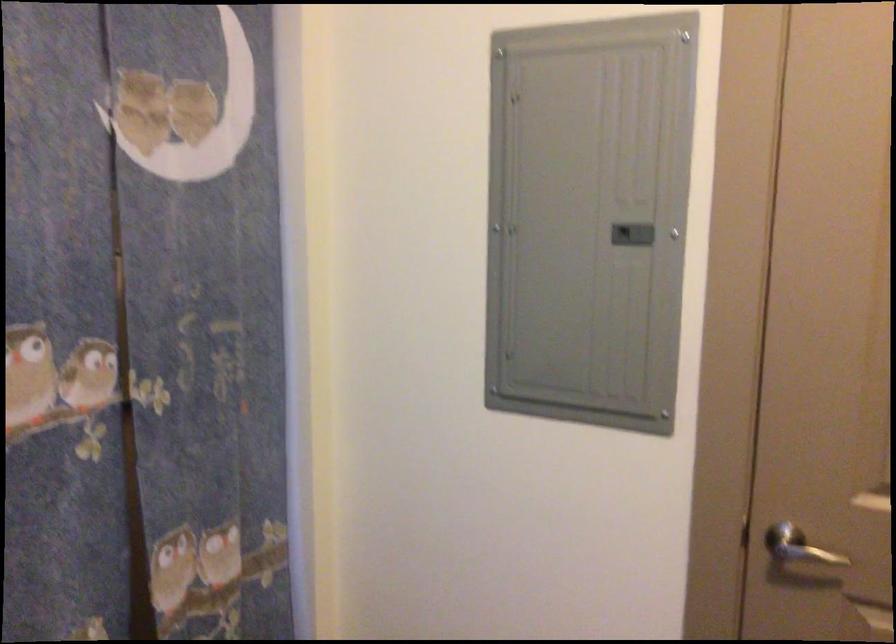
What do you see at coordinates (806, 554) in the screenshot? I see `the silver door handle` at bounding box center [806, 554].